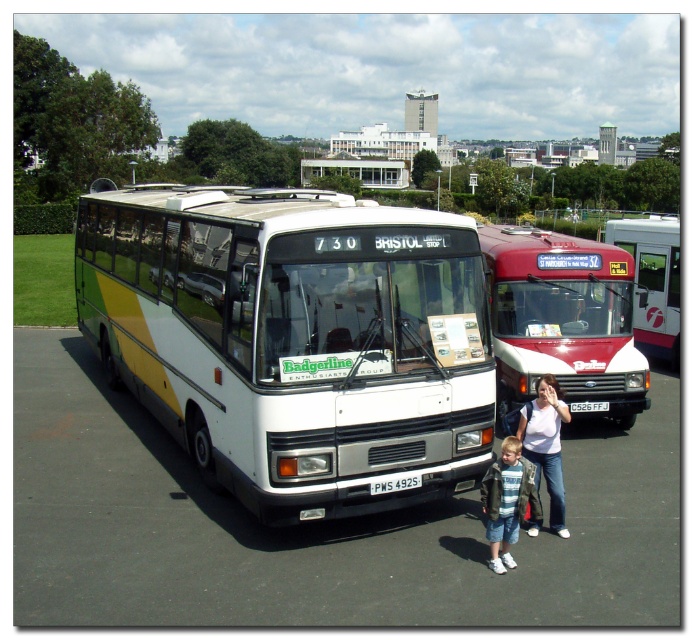
Question: Which of the following is the closest to the observer?

Choices:
 (A) (499, 515)
 (B) (164, 593)
 (C) (660, 285)

Answer: (B)

Question: Observing the image, what is the correct spatial positioning of white asphalt at center in reference to red metallic bus at center?

Choices:
 (A) left
 (B) right

Answer: (A)

Question: Is leather jacket at lower right above white cotton shirt at lower center?

Choices:
 (A) no
 (B) yes

Answer: (A)

Question: Which of the following is the farthest from the observer?

Choices:
 (A) (169, 387)
 (B) (500, 524)

Answer: (A)

Question: Is white asphalt at center bigger than red metallic bus at center?

Choices:
 (A) yes
 (B) no

Answer: (B)

Question: Which point is farther to the camera?

Choices:
 (A) red metallic bus at center
 (B) leather jacket at lower right
 (C) maroon matte bus at center
 (D) white/yellow/green striped bus at left

Answer: (A)